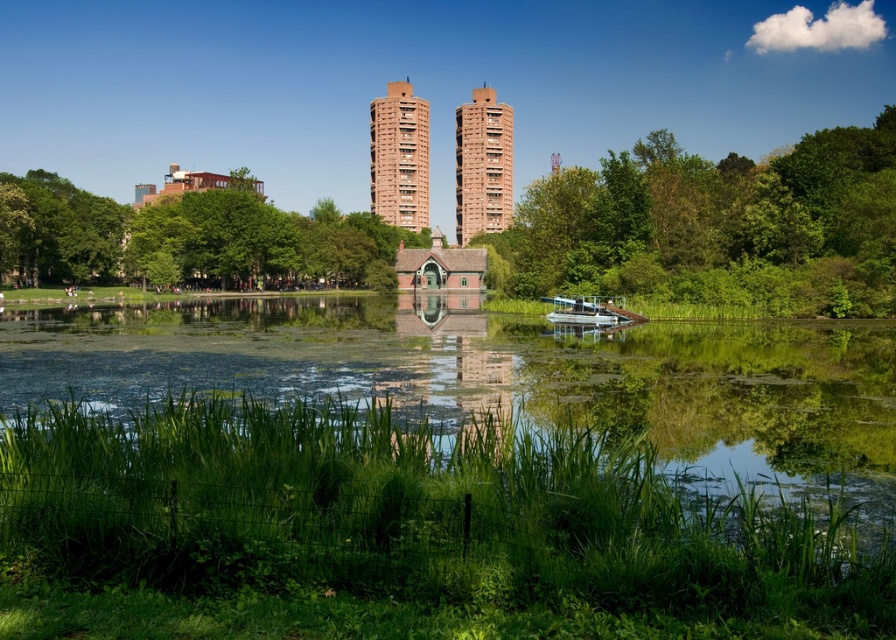
Does green leafy tree at center have a lesser height compared to metallic silver pontoon boat at center?

No.

Measure the distance between point (877, 236) and camera.

The distance of point (877, 236) from camera is 115.34 meters.

This screenshot has height=640, width=896. What are the coordinates of `green leafy tree at center` in the screenshot? It's located at (716, 227).

Who is more distant from viewer, (300, 333) or (842, 237)?

The point (842, 237) is more distant.

Who is more forward, (309, 305) or (606, 180)?

Positioned in front is point (606, 180).

Image resolution: width=896 pixels, height=640 pixels. What do you see at coordinates (506, 380) in the screenshot? I see `green grassy river at center` at bounding box center [506, 380].

Find the location of `green grassy river at center`. green grassy river at center is located at coordinates (506, 380).

Who is more forward, (x=579, y=280) or (x=268, y=221)?

Point (x=579, y=280)

Can you confirm if green leafy tree at center is positioned above green leafy tree at upper left?

No.

Is point (755, 184) farther from viewer compared to point (367, 257)?

No, it is not.

Locate an element on the screen. This screenshot has width=896, height=640. green leafy tree at center is located at coordinates (716, 227).